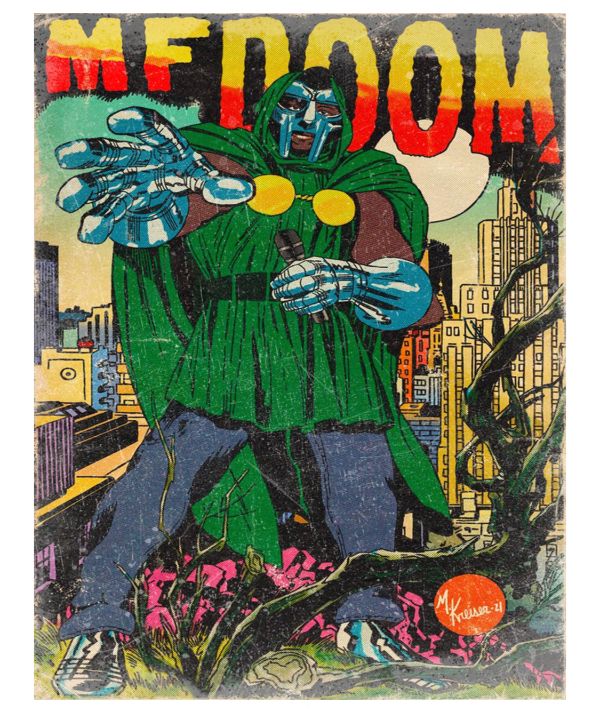
I want to click on hood, so click(x=270, y=94), click(x=347, y=119).